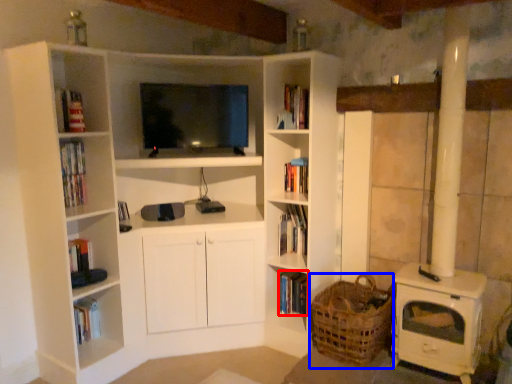
Question: Which object appears closest to the camera in this image, book (highlighted by a red box) or basket (highlighted by a blue box)?

Choices:
 (A) book
 (B) basket

Answer: (B)